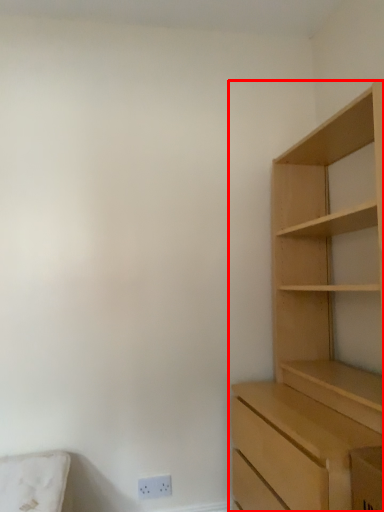
Question: Observing the image, what is the correct spatial positioning of cupboard (annotated by the red box) in reference to electric outlet?

Choices:
 (A) right
 (B) left

Answer: (A)